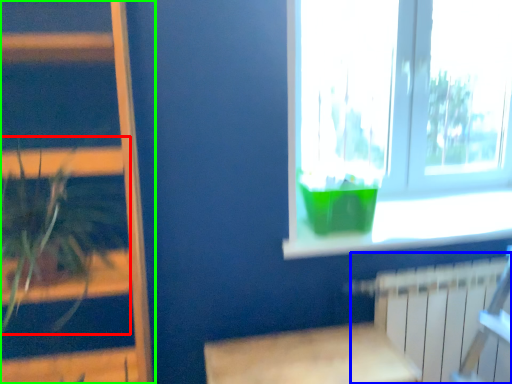
Question: Which object is positioned closest to houseplant (highlighted by a red box)? Select from radiator (highlighted by a blue box) and bookshelf (highlighted by a green box).

Choices:
 (A) radiator
 (B) bookshelf

Answer: (B)